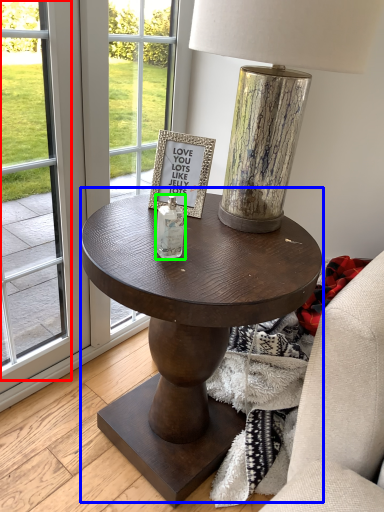
Question: Which object is positioned closest to screen door (highlighted by a red box)? Select from coffee table (highlighted by a blue box) and bottle (highlighted by a green box).

Choices:
 (A) coffee table
 (B) bottle

Answer: (A)